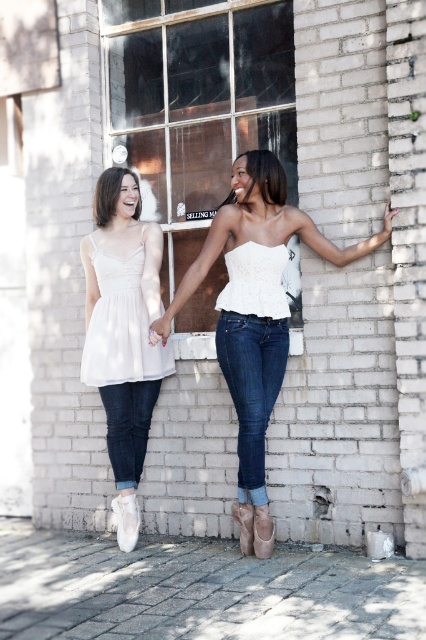
Can you confirm if clear glass window at center is bigger than dark blue denim jeans at lower left?

Yes.

Which of these two, clear glass window at center or dark blue denim jeans at lower left, stands taller?

clear glass window at center

Who is more forward, (x=164, y=192) or (x=127, y=401)?

Point (x=127, y=401)

The image size is (426, 640). In order to click on clear glass window at center in this screenshot , I will do `click(196, 104)`.

Is point (253, 342) positioned behind point (86, 378)?

No, it is in front of (86, 378).

How far apart are dark blue denim jeans at center and white satin dress at left?

dark blue denim jeans at center and white satin dress at left are 23.45 inches apart from each other.

Which is in front, point (242, 445) or point (129, 301)?

Positioned in front is point (242, 445).

This screenshot has height=640, width=426. Find the location of `dark blue denim jeans at center`. dark blue denim jeans at center is located at coordinates (252, 387).

Between white matte dress at left and dark blue denim jeans at lower left, which one is positioned higher?

Positioned higher is white matte dress at left.

Between point (127, 392) and point (108, 388), which one is positioned in front?

Point (108, 388)

Locate an element on the screen. white matte dress at left is located at coordinates (123, 332).